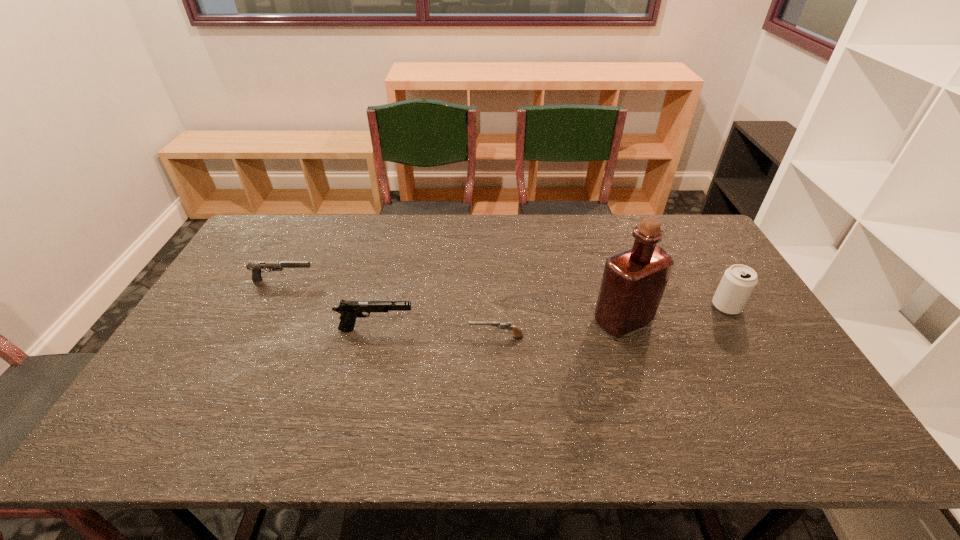
Where is `free space that satisfies the following two spatial constraints: 1. on the back side of the second object from right to left; 2. at the muzzle end of the farthest gun`? This screenshot has height=540, width=960. free space that satisfies the following two spatial constraints: 1. on the back side of the second object from right to left; 2. at the muzzle end of the farthest gun is located at coordinates (610, 280).